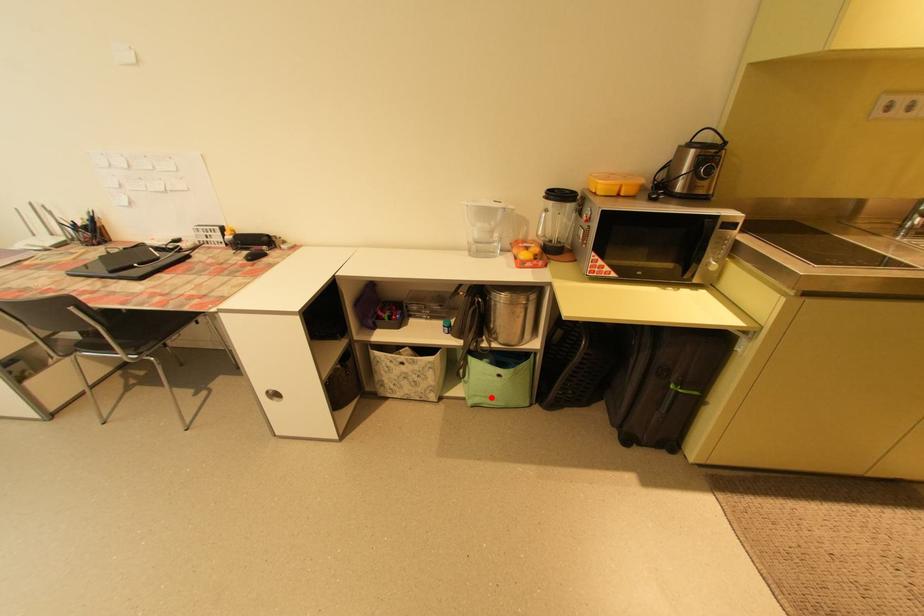
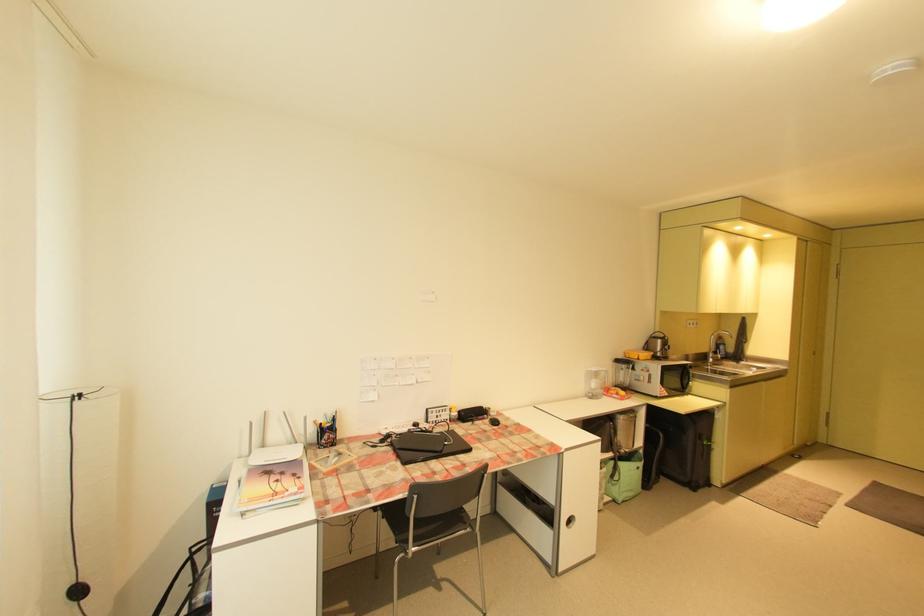
The point at the highlighted location is marked in the first image. Where is the corresponding point in the second image?

(634, 492)